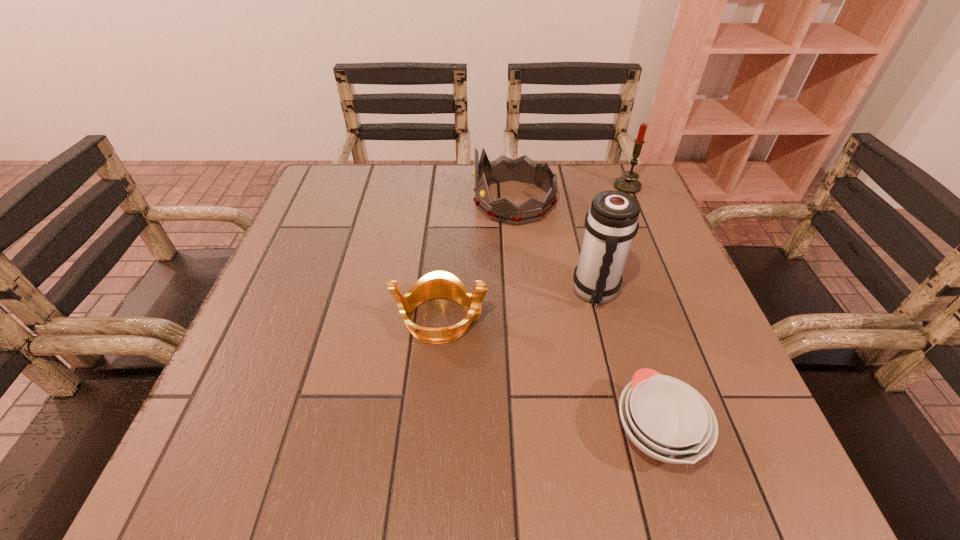
Find the location of `vacant region located 0.240m on the left of the second tallest object`. vacant region located 0.240m on the left of the second tallest object is located at coordinates (522, 186).

Locate an element on the screen. The width and height of the screenshot is (960, 540). vacant space located at the front of the farther tiara with jewels is located at coordinates (316, 201).

Locate an element on the screen. The height and width of the screenshot is (540, 960). free space located at the front of the farther tiara with jewels is located at coordinates (336, 201).

The image size is (960, 540). I want to click on vacant area situated 0.330m at the front of the farther tiara with jewels, so click(x=341, y=201).

At what (x,y) coordinates should I click in order to perform the action: click on blank space located at the front emblem of the nearer tiara. Please return your answer as a coordinate pair (x, y). Looking at the image, I should click on (678, 319).

Where is `vacant area situated 0.210m on the left of the soup bowl`? The height and width of the screenshot is (540, 960). vacant area situated 0.210m on the left of the soup bowl is located at coordinates (474, 431).

This screenshot has width=960, height=540. Find the location of `candle present at the far edge`. candle present at the far edge is located at coordinates (628, 183).

Find the location of a particular element. tiara present at the far edge is located at coordinates (523, 169).

You are a GUI agent. You are given a task and a screenshot of the screen. Output one action in this format:
    pyautogui.click(x=<x>, y=<y>)
    Task: Click on the object at the near edge
    The width and height of the screenshot is (960, 540).
    Given the screenshot: What is the action you would take?
    pyautogui.click(x=667, y=419)

You are a GUI agent. You are given a task and a screenshot of the screen. Output one action in this format:
    pyautogui.click(x=<x>, y=<y>)
    Task: Click on the thermos bottle that is at the right edge
    The width and height of the screenshot is (960, 540).
    Given the screenshot: What is the action you would take?
    pyautogui.click(x=611, y=223)